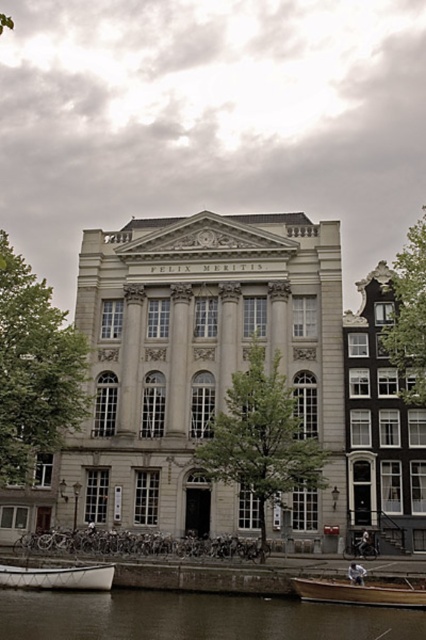
Looking at this image, you are standing in front of the grand neoclassical building. You see a green leafy tree at left and a wooden boat at lower right. Which object is closer to you?

The green leafy tree at left is closer to you because it is further to the viewer than the wooden boat at lower right.

You are standing in front of the grand neoclassical building with the inscription FELIX MERITIS. There are two points marked on the ground in front of you. One is at point [8,406] and the other at point [80,584]. Which point is closer to you as you face the building?

Point [8,406] is further to the camera than point [80,584], so the point closer to you is point [80,584].

You are standing in front of the grand neoclassical building with the inscription. You notice a green leafy tree at left and a white matte boat at lower left. Which object is taller?

The green leafy tree at left is taller than the white matte boat at lower left.